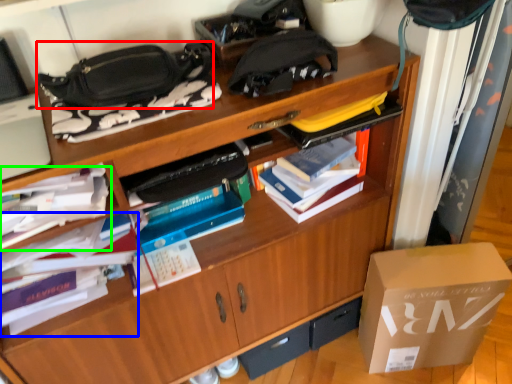
Question: Estimate the real-world distances between objects in this image. Which object is closer to handbag (highlighted by a red box), book (highlighted by a blue box) or book (highlighted by a green box)?

Choices:
 (A) book
 (B) book

Answer: (B)